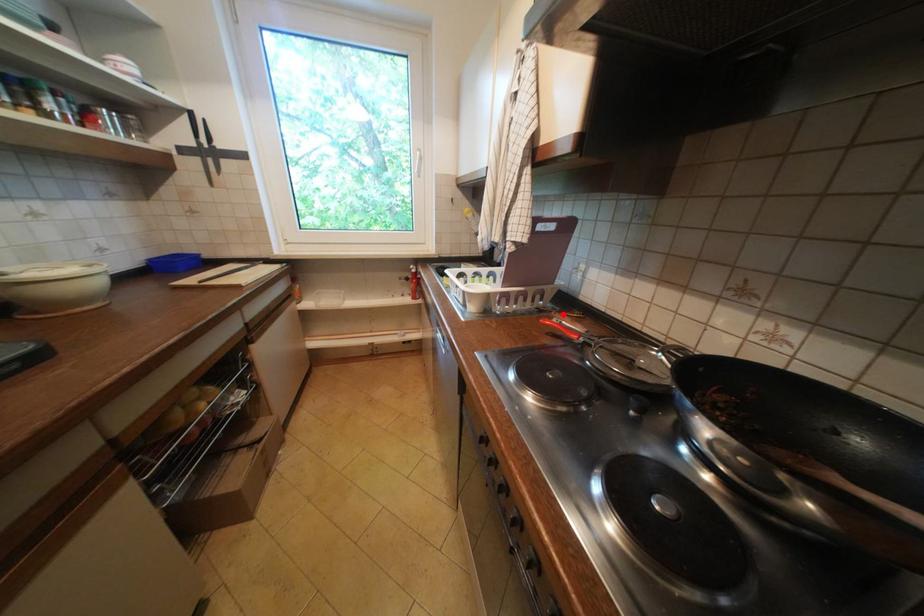
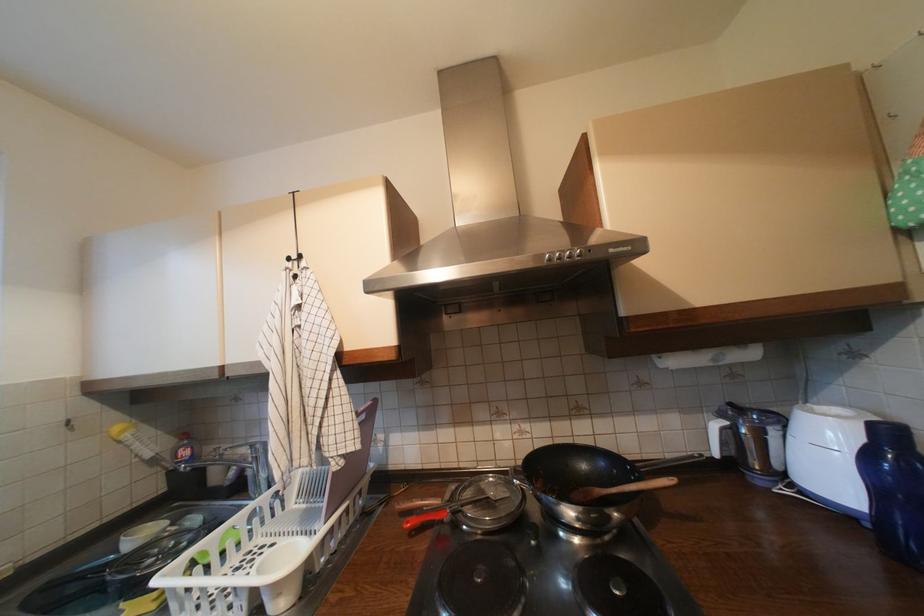
In the second image, find the point that corresponds to the highlighted location in the first image.

(407, 506)